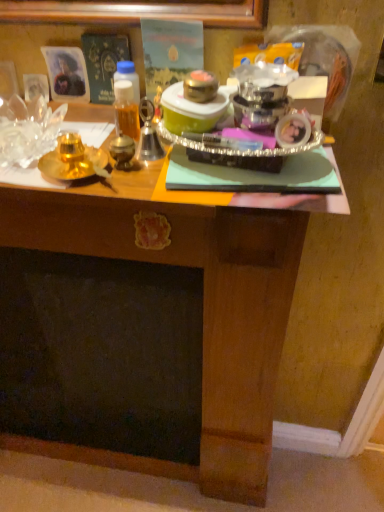
Find the location of `wooden desk at center`. wooden desk at center is located at coordinates (203, 296).

What do you see at coordinates (203, 296) in the screenshot?
I see `wooden desk at center` at bounding box center [203, 296].

Find the location of a particular element. The width and height of the screenshot is (384, 512). wooden desk at center is located at coordinates (203, 296).